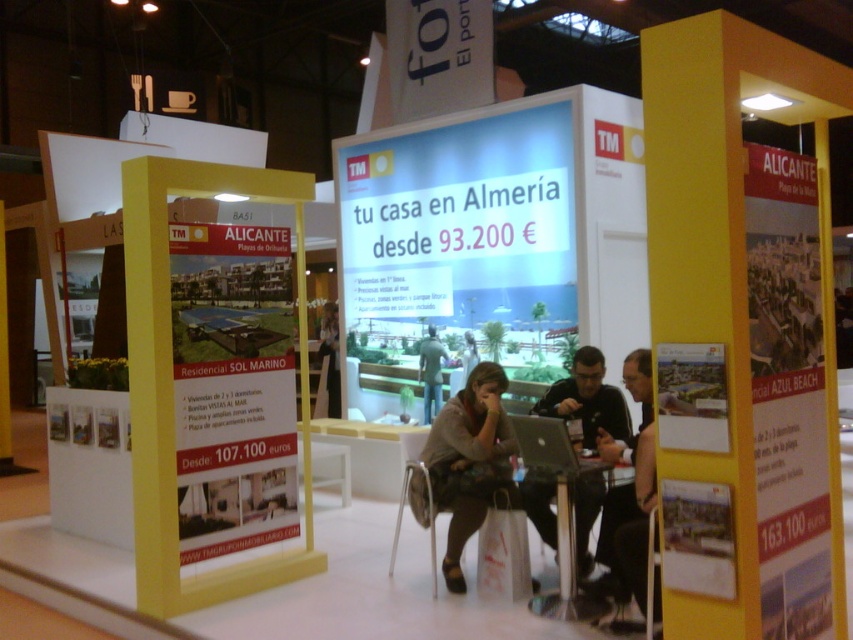
You are a visitor at the exhibition booth and notice two items displayed at the center. The brown fabric shirt at center and the green fabric jacket at center. Which one is positioned lower?

The brown fabric shirt at center is positioned lower because it is below the green fabric jacket at center.

Looking at this image, you are a real estate agent at the booth and need to present a property to a client. You have a matte black laptop at center and a dark gray fabric jacket at center. Which item should you use to show the property details?

You should use the matte black laptop at center to show the property details because it is taller than the dark gray fabric jacket at center and likely has the necessary digital information.

What is the object located at the coordinates point (630, 493)?

The object located at point (630, 493) is the matte black laptop at center.